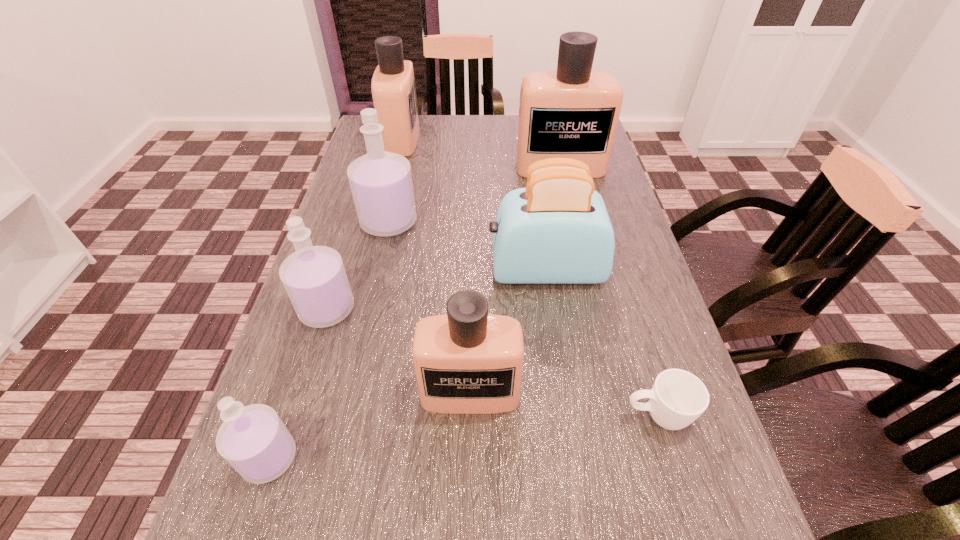
Find the location of a particular element. The height and width of the screenshot is (540, 960). perfume object that ranks as the fifth closest to the smallest purple perfume is located at coordinates (572, 112).

Locate which beige perfume ranks third in proximity to the shortest object. Please provide its 2D coordinates. Your answer should be formatted as a tuple, i.e. [(x, y)], where the tuple contains the x and y coordinates of a point satisfying the conditions above.

[(572, 112)]

Where is `beige perfume that can be found as the second closest to the nearest beige perfume`? beige perfume that can be found as the second closest to the nearest beige perfume is located at coordinates (572, 112).

Identify which purple perfume is the nearest to the seventh nearest object. Please provide its 2D coordinates. Your answer should be formatted as a tuple, i.e. [(x, y)], where the tuple contains the x and y coordinates of a point satisfying the conditions above.

[(314, 277)]

Choose which purple perfume is the second nearest neighbor to the nearest beige perfume. Please provide its 2D coordinates. Your answer should be formatted as a tuple, i.e. [(x, y)], where the tuple contains the x and y coordinates of a point satisfying the conditions above.

[(314, 277)]

Find the location of `vacant area that satisfies the following two spatial constraints: 1. on the front label of the tallest perfume; 2. on the side of the light toaster with the lever`. vacant area that satisfies the following two spatial constraints: 1. on the front label of the tallest perfume; 2. on the side of the light toaster with the lever is located at coordinates (584, 270).

Where is `free space that satisfies the following two spatial constraints: 1. on the front label of the leftmost beige perfume; 2. on the right side of the biggest purple perfume`? The height and width of the screenshot is (540, 960). free space that satisfies the following two spatial constraints: 1. on the front label of the leftmost beige perfume; 2. on the right side of the biggest purple perfume is located at coordinates (381, 222).

I want to click on blank area in the image that satisfies the following two spatial constraints: 1. on the front label of the leftmost beige perfume; 2. on the right side of the biggest purple perfume, so (381, 222).

In order to click on free space in the image that satisfies the following two spatial constraints: 1. on the back side of the sixth farthest perfume; 2. on the left side of the farthest purple perfume in this screenshot , I will do `click(348, 222)`.

Where is `free spot that satisfies the following two spatial constraints: 1. on the front label of the third smallest beige perfume; 2. on the back side of the third farthest perfume`? This screenshot has width=960, height=540. free spot that satisfies the following two spatial constraints: 1. on the front label of the third smallest beige perfume; 2. on the back side of the third farthest perfume is located at coordinates tap(381, 222).